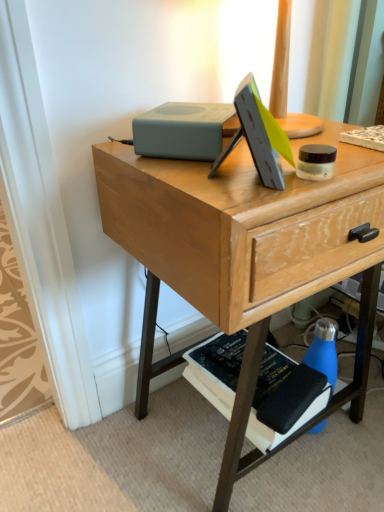
Question: From the image's perspective, is wooden desk at center beneath hardcover black book at lower right?

Choices:
 (A) yes
 (B) no

Answer: (B)

Question: Can we say wooden desk at center lies outside hardcover black book at lower right?

Choices:
 (A) yes
 (B) no

Answer: (A)

Question: Is wooden desk at center in contact with hardcover black book at lower right?

Choices:
 (A) yes
 (B) no

Answer: (B)

Question: From a real-world perspective, is wooden desk at center under hardcover black book at lower right?

Choices:
 (A) yes
 (B) no

Answer: (B)

Question: Can you confirm if wooden desk at center is smaller than hardcover black book at lower right?

Choices:
 (A) no
 (B) yes

Answer: (A)

Question: Considering the relative positions of blue matte water bottle at lower right and hardcover black book at lower right in the image provided, is blue matte water bottle at lower right to the left or to the right of hardcover black book at lower right?

Choices:
 (A) left
 (B) right

Answer: (B)

Question: In the image, is blue matte water bottle at lower right positioned in front of or behind hardcover black book at lower right?

Choices:
 (A) front
 (B) behind

Answer: (B)

Question: From the image's perspective, is blue matte water bottle at lower right positioned above or below hardcover black book at lower right?

Choices:
 (A) below
 (B) above

Answer: (B)

Question: Considering the positions of point (334, 347) and point (226, 344), is point (334, 347) closer or farther from the camera than point (226, 344)?

Choices:
 (A) farther
 (B) closer

Answer: (A)

Question: Is hardcover black book at lower right to the left or to the right of wooden desk at center in the image?

Choices:
 (A) left
 (B) right

Answer: (B)

Question: Considering the positions of hardcover black book at lower right and wooden desk at center in the image, is hardcover black book at lower right bigger or smaller than wooden desk at center?

Choices:
 (A) big
 (B) small

Answer: (B)

Question: From the image's perspective, is hardcover black book at lower right positioned above or below wooden desk at center?

Choices:
 (A) above
 (B) below

Answer: (B)

Question: Considering the positions of hardcover black book at lower right and wooden desk at center in the image, is hardcover black book at lower right wider or thinner than wooden desk at center?

Choices:
 (A) thin
 (B) wide

Answer: (A)

Question: Looking at the image, does wooden desk at center seem bigger or smaller compared to hardcover black book at lower right?

Choices:
 (A) small
 (B) big

Answer: (B)

Question: From their relative heights in the image, would you say wooden desk at center is taller or shorter than hardcover black book at lower right?

Choices:
 (A) short
 (B) tall

Answer: (B)